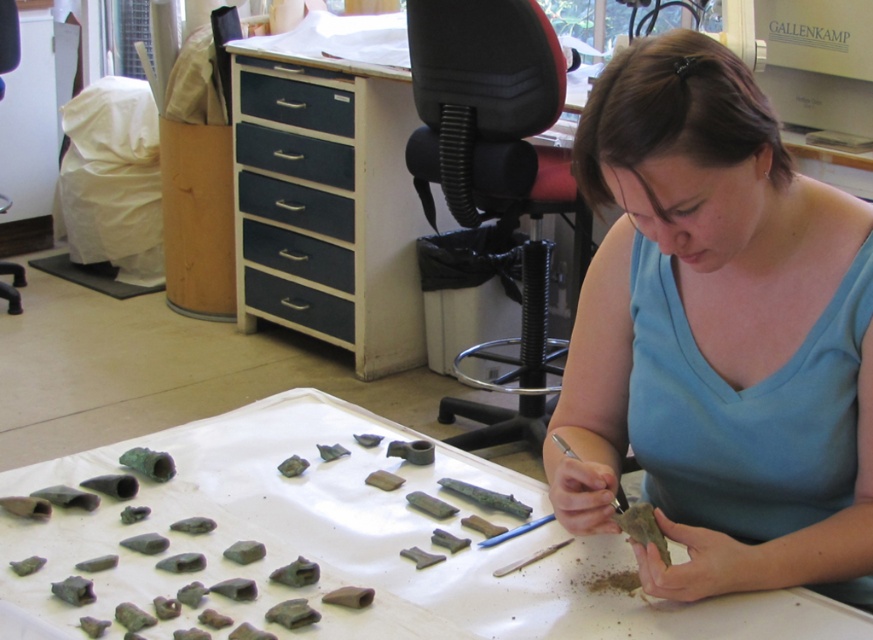
You are organizing a collection of artifacts in the workspace. You have two drawers available for storage. The blue matte drawer at center and the blue painted wood drawer at center. Which drawer should you choose to store a large artifact that is 30 cm wide?

The blue matte drawer at center should be chosen because its width is larger than the blue painted wood drawer at center, making it more suitable for storing the 30 cm wide artifact.

You are an archaeologist working in the depicted workspace. You need to access both the blue matte drawer at center and the black matte drawer at center. Which drawer should you open first if you want to reach the one that is positioned higher?

The blue matte drawer at center is above the black matte drawer at center, so you should open the blue matte drawer at center first to access the higher one.